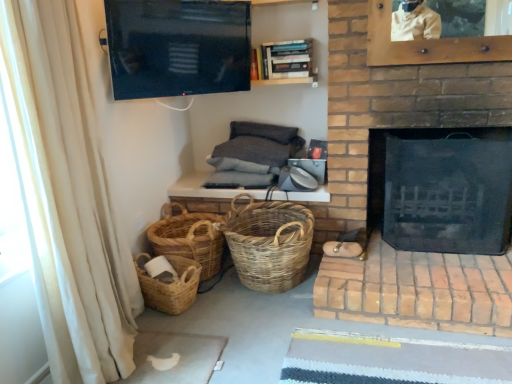
Where is `vacant area located to the right-hand side of beige fabric curtain at left`? vacant area located to the right-hand side of beige fabric curtain at left is located at coordinates (206, 345).